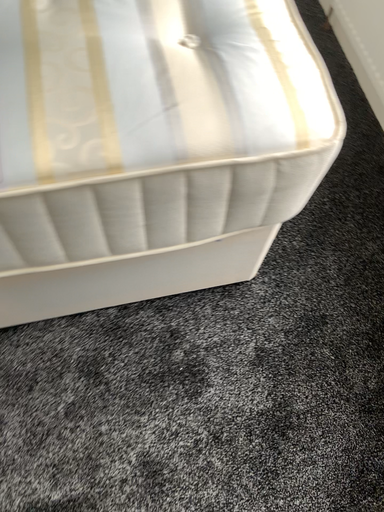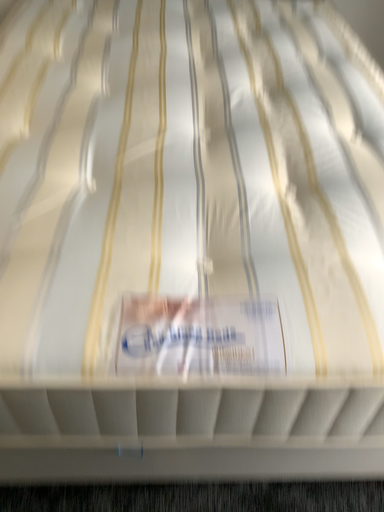
Question: How did the camera likely rotate when shooting the video?

Choices:
 (A) rotated downward
 (B) rotated upward

Answer: (B)